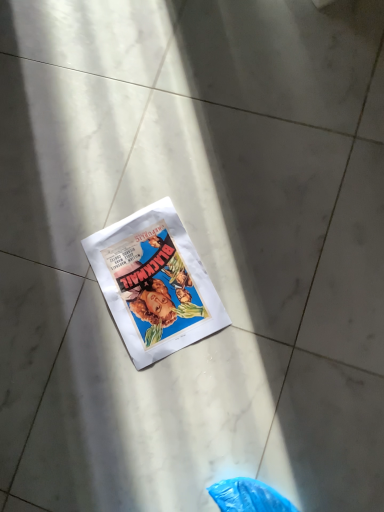
Locate an element on the screen. free point above printed paper poster at center (from a real-world perspective) is located at coordinates (153, 280).